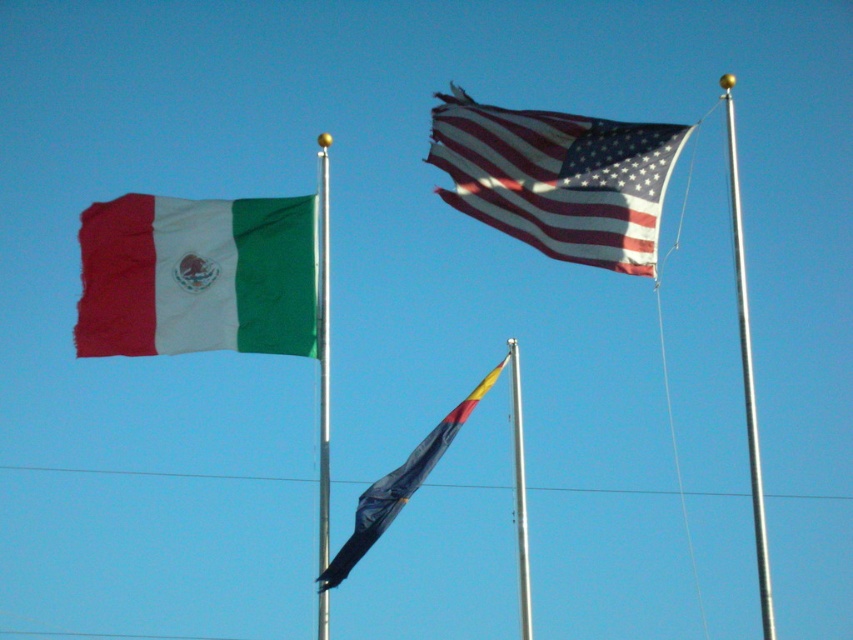
This screenshot has height=640, width=853. Identify the location of rippled fabric flag at upper center. (556, 179).

Who is more distant from viewer, (636, 145) or (755, 493)?

The point (636, 145) is behind.

Locate an element on the screen. This screenshot has height=640, width=853. rippled fabric flag at upper center is located at coordinates (556, 179).

Does textured cotton flag at left have a lesser height compared to silver metallic flag pole at center?

Indeed, textured cotton flag at left has a lesser height compared to silver metallic flag pole at center.

The image size is (853, 640). In order to click on textured cotton flag at left in this screenshot , I will do `click(196, 276)`.

This screenshot has height=640, width=853. I want to click on textured cotton flag at left, so click(196, 276).

Can you confirm if rippled fabric flag at upper center is wider than silver metallic pole at center?

Indeed, rippled fabric flag at upper center has a greater width compared to silver metallic pole at center.

Is rippled fabric flag at upper center above silver metallic pole at center?

Indeed, rippled fabric flag at upper center is positioned over silver metallic pole at center.

Is point (625, 216) positioned in front of point (527, 634)?

That is False.

Where is `rippled fabric flag at upper center`? Image resolution: width=853 pixels, height=640 pixels. rippled fabric flag at upper center is located at coordinates (556, 179).